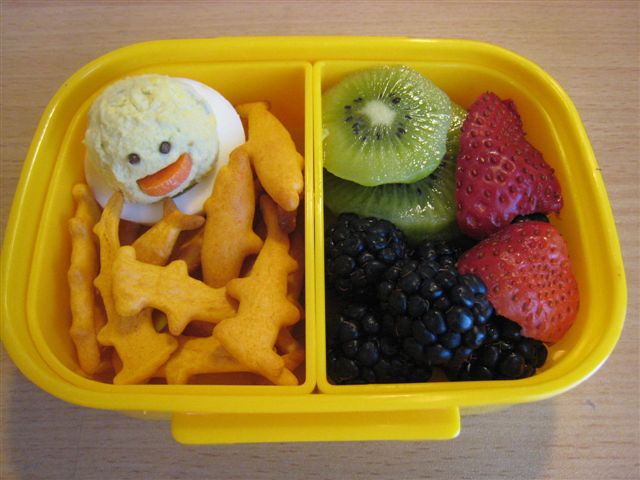
Image resolution: width=640 pixels, height=480 pixels. In order to click on yellow plastic lunch divided container in this screenshot , I will do `click(310, 399)`.